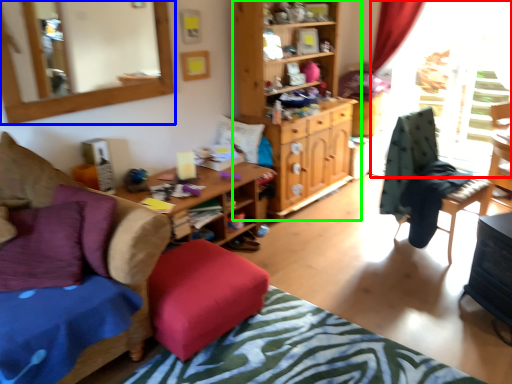
Question: Based on their relative distances, which object is nearer to window screen (highlighted by a red box)? Choose from mirror (highlighted by a blue box) and cabinetry (highlighted by a green box).

Choices:
 (A) mirror
 (B) cabinetry

Answer: (B)